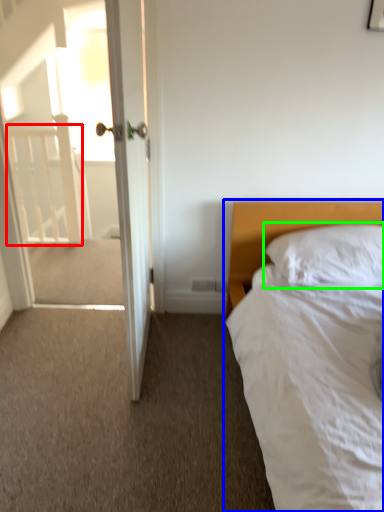
Question: Considering the real-world distances, which object is closest to balustrade (highlighted by a red box)? bed (highlighted by a blue box) or pillow (highlighted by a green box).

Choices:
 (A) bed
 (B) pillow

Answer: (A)